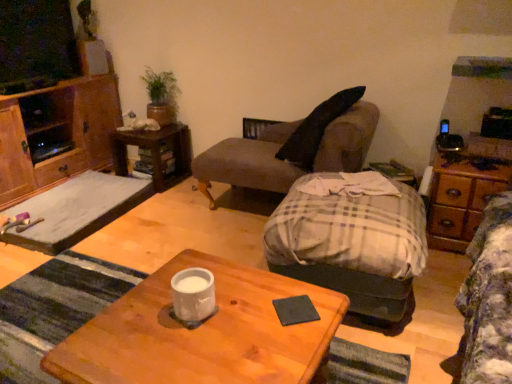
I want to click on free space above wooden desk at center (from a real-world perspective), so click(202, 325).